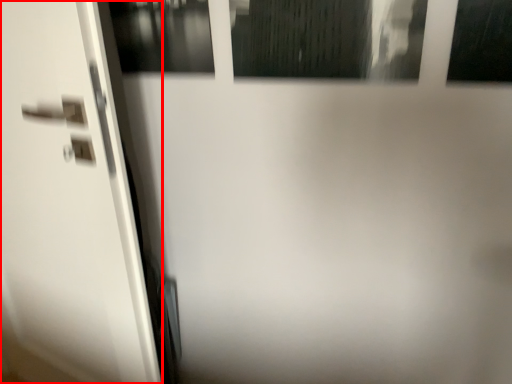
Question: Observing the image, what is the correct spatial positioning of screen door (annotated by the red box) in reference to window?

Choices:
 (A) left
 (B) right

Answer: (A)